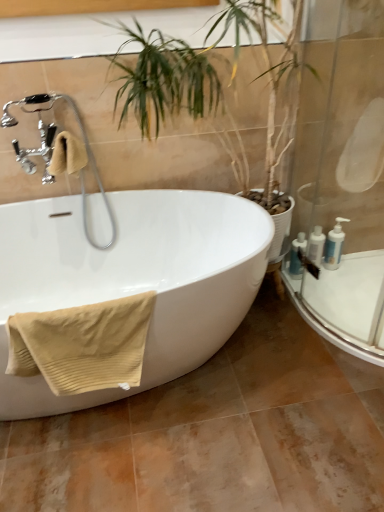
Where is `beige ribbed towel at left, the 1th bath towel from the back`? The width and height of the screenshot is (384, 512). beige ribbed towel at left, the 1th bath towel from the back is located at coordinates (67, 155).

What is the approximate width of white glossy bottle at right, the second toiletry from the left?

white glossy bottle at right, the second toiletry from the left, is 3.55 inches wide.

What do you see at coordinates (84, 153) in the screenshot? The width and height of the screenshot is (384, 512). I see `chrome/metallic faucet at upper left` at bounding box center [84, 153].

This screenshot has width=384, height=512. What do you see at coordinates (165, 78) in the screenshot?
I see `green leafy plant at center` at bounding box center [165, 78].

The width and height of the screenshot is (384, 512). Find the location of `beige ribbed towel at left, the 2th bath towel from the front`. beige ribbed towel at left, the 2th bath towel from the front is located at coordinates (67, 155).

Does white glossy pump bottles at right, the third toiletry in the left-to-right sequence, have a larger size compared to transparent glass shower door at right?

Actually, white glossy pump bottles at right, the third toiletry in the left-to-right sequence, might be smaller than transparent glass shower door at right.

From a real-world perspective, who is located higher, white glossy pump bottles at right, positioned as the first toiletry in right-to-left order, or transparent glass shower door at right?

transparent glass shower door at right is physically above.

From the image's perspective, is white glossy pump bottles at right, the third toiletry in the left-to-right sequence, over transparent glass shower door at right?

Actually, white glossy pump bottles at right, the third toiletry in the left-to-right sequence, appears below transparent glass shower door at right in the image.

Which object is more forward, white glossy pump bottles at right, positioned as the first toiletry in right-to-left order, or transparent glass shower door at right?

transparent glass shower door at right is more forward.

Based on their positions, is beige ribbed towel at lower left, which is the first bath towel from bottom to top, located to the left or right of beige ribbed towel at left, the 1th bath towel from the back?

beige ribbed towel at lower left, which is the first bath towel from bottom to top, is positioned on beige ribbed towel at left, the 1th bath towel from the back,'s right side.

How distant is beige ribbed towel at lower left, the second bath towel in the back-to-front sequence, from beige ribbed towel at left, the second bath towel when ordered from bottom to top?

beige ribbed towel at lower left, the second bath towel in the back-to-front sequence, is 29.71 inches from beige ribbed towel at left, the second bath towel when ordered from bottom to top.

Which point is more distant from viewer, [57,388] or [52,156]?

The point [52,156] is farther from the camera.

Is beige ribbed towel at lower left, the first bath towel from the front, oriented away from beige ribbed towel at left, which appears as the 1th bath towel when viewed from the top?

No, beige ribbed towel at left, which appears as the 1th bath towel when viewed from the top, is not at the back of beige ribbed towel at lower left, the first bath towel from the front.

Does beige ribbed towel at left, the 2th bath towel from the front, have a lesser height compared to green leafy plant at center?

Indeed, beige ribbed towel at left, the 2th bath towel from the front, has a lesser height compared to green leafy plant at center.

From a real-world perspective, who is located higher, beige ribbed towel at left, the 2th bath towel from the front, or green leafy plant at center?

beige ribbed towel at left, the 2th bath towel from the front, from a real-world perspective.

Looking at their sizes, would you say beige ribbed towel at left, the second bath towel when ordered from bottom to top, is wider or thinner than green leafy plant at center?

beige ribbed towel at left, the second bath towel when ordered from bottom to top, is thinner than green leafy plant at center.

Is beige ribbed towel at left, the 2th bath towel from the front, aimed at green leafy plant at center?

No, beige ribbed towel at left, the 2th bath towel from the front, is not facing towards green leafy plant at center.

Is there a large distance between white glossy bathtub at center and white glossy bottle at right, which is the 2th toiletry in right-to-left order?

Actually, white glossy bathtub at center and white glossy bottle at right, which is the 2th toiletry in right-to-left order, are a little close together.

Which point is more forward, (100, 253) or (319, 247)?

The point (100, 253) is more forward.

In order to click on bathtub in front of the white glossy bottle at right, the second toiletry from the left in this screenshot , I will do `click(133, 279)`.

Considering the positions of objects white glossy bottle at right, the second toiletry from the left, and green leafy plant at center in the image provided, who is more to the right, white glossy bottle at right, the second toiletry from the left, or green leafy plant at center?

Positioned to the right is white glossy bottle at right, the second toiletry from the left.

Considering the sizes of objects white glossy bottle at right, the second toiletry from the left, and green leafy plant at center in the image provided, who is bigger, white glossy bottle at right, the second toiletry from the left, or green leafy plant at center?

With larger size is green leafy plant at center.

Relative to green leafy plant at center, is white glossy bottle at right, which is the 2th toiletry in right-to-left order, in front or behind?

Clearly, white glossy bottle at right, which is the 2th toiletry in right-to-left order, is behind green leafy plant at center.

Is white glossy pump bottles at right, the third toiletry in the left-to-right sequence, wider than beige ribbed towel at left, which appears as the 1th bath towel when viewed from the top?

In fact, white glossy pump bottles at right, the third toiletry in the left-to-right sequence, might be narrower than beige ribbed towel at left, which appears as the 1th bath towel when viewed from the top.

Is white glossy pump bottles at right, positioned as the first toiletry in right-to-left order, oriented towards beige ribbed towel at left, which appears as the 1th bath towel when viewed from the top?

No, white glossy pump bottles at right, positioned as the first toiletry in right-to-left order, is not oriented towards beige ribbed towel at left, which appears as the 1th bath towel when viewed from the top.

Does white glossy pump bottles at right, the third toiletry in the left-to-right sequence, have a greater height compared to beige ribbed towel at left, which appears as the 1th bath towel when viewed from the top?

Yes.

Looking at the image, does white glossy pump bottles at right, the third toiletry in the left-to-right sequence, seem bigger or smaller compared to beige ribbed towel at left, the 1th bath towel from the back?

In the image, white glossy pump bottles at right, the third toiletry in the left-to-right sequence, appears to be smaller than beige ribbed towel at left, the 1th bath towel from the back.

Is point (99, 196) positioned behind point (374, 286)?

That is False.

Does white glossy bathtub at center have a greater height compared to transparent glass shower door at right?

No.

From the picture: Is white glossy bathtub at center inside or outside of transparent glass shower door at right?

white glossy bathtub at center is outside transparent glass shower door at right.

Which toiletry is the 2nd one when counting from the right side of the transparent glass shower door at right? Please provide its 2D coordinates.

[(334, 245)]

Locate an element on the screen. bath towel in front of the beige ribbed towel at left, the 1th bath towel from the back is located at coordinates (82, 344).

Looking at this image, considering their positions, is chrome/metallic faucet at upper left positioned further to white glossy bottle at right, which is the 2th toiletry in right-to-left order, than green leafy plant at center?

chrome/metallic faucet at upper left lies further to white glossy bottle at right, which is the 2th toiletry in right-to-left order, than the other object.

When comparing their distances from white glossy pump bottles at right, positioned as the first toiletry in right-to-left order, does white glossy bathtub at center or chrome/metallic faucet at upper left seem further?

chrome/metallic faucet at upper left.

Based on their spatial positions, is green leafy plant at center or beige ribbed towel at left, the second bath towel when ordered from bottom to top, closer to beige ribbed towel at lower left, the first bath towel from the front?

Among the two, beige ribbed towel at left, the second bath towel when ordered from bottom to top, is located nearer to beige ribbed towel at lower left, the first bath towel from the front.

Considering their positions, is green leafy plant at center positioned further to white glossy bottles at right, placed as the first toiletry when sorted from left to right, than beige ribbed towel at left, the second bath towel when ordered from bottom to top?

beige ribbed towel at left, the second bath towel when ordered from bottom to top, is positioned further to the anchor white glossy bottles at right, placed as the first toiletry when sorted from left to right.

From the image, which object appears to be nearer to beige ribbed towel at lower left, the first bath towel from the front, transparent glass shower door at right or green leafy plant at center?

green leafy plant at center.

When comparing their distances from green leafy plant at center, does chrome/metallic faucet at upper left or white glossy bottles at right, placed as the first toiletry when sorted from left to right, seem further?

white glossy bottles at right, placed as the first toiletry when sorted from left to right, lies further to green leafy plant at center than the other object.

Estimate the real-world distances between objects in this image. Which object is further from beige ribbed towel at lower left, the first bath towel from the front, chrome/metallic faucet at upper left or white glossy bathtub at center?

chrome/metallic faucet at upper left is further to beige ribbed towel at lower left, the first bath towel from the front.

When comparing their distances from beige ribbed towel at left, which appears as the 1th bath towel when viewed from the top, does white glossy bottles at right, the third toiletry from the right, or chrome/metallic faucet at upper left seem further?

Based on the image, white glossy bottles at right, the third toiletry from the right, appears to be further to beige ribbed towel at left, which appears as the 1th bath towel when viewed from the top.

The height and width of the screenshot is (512, 384). I want to click on bath towel between beige ribbed towel at left, the second bath towel when ordered from bottom to top, and white glossy pump bottles at right, the third toiletry in the left-to-right sequence, from left to right, so click(x=82, y=344).

Find the location of `bathtub between chrome/metallic faucet at upper left and white glossy pump bottles at right, the third toiletry in the left-to-right sequence, from left to right`. bathtub between chrome/metallic faucet at upper left and white glossy pump bottles at right, the third toiletry in the left-to-right sequence, from left to right is located at coordinates (133, 279).

Where is `bathtub positioned between green leafy plant at center and white glossy bottle at right, which is the 2th toiletry in right-to-left order, from near to far`? bathtub positioned between green leafy plant at center and white glossy bottle at right, which is the 2th toiletry in right-to-left order, from near to far is located at coordinates (133, 279).

What are the coordinates of `houseplant between chrome/metallic faucet at upper left and transparent glass shower door at right` in the screenshot? It's located at [165, 78].